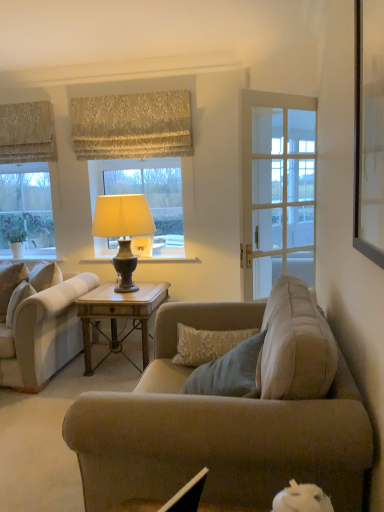
Find the location of `free space above beige textured curtain at upper left, which is counted as the second curtain, starting from the right (from a real-world perspective)`. free space above beige textured curtain at upper left, which is counted as the second curtain, starting from the right (from a real-world perspective) is located at coordinates (21, 102).